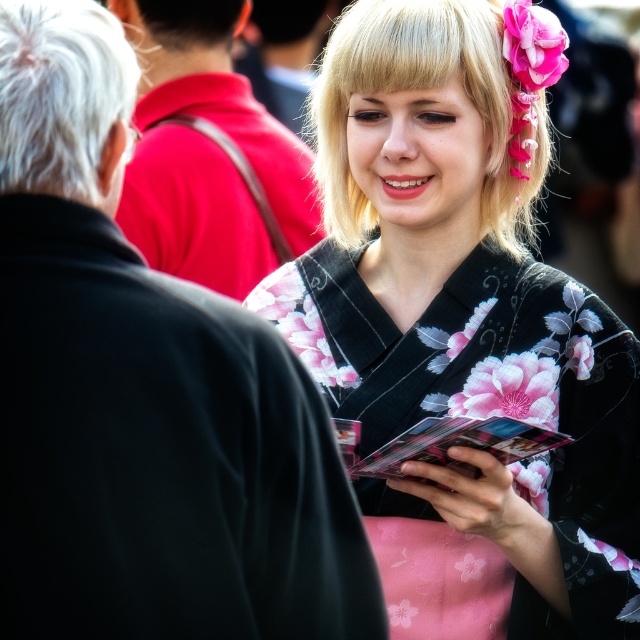
Question: Which point is farther to the camera?

Choices:
 (A) (380, 1)
 (B) (54, 92)

Answer: (A)

Question: Is black floral kimono at center above blonde hair at upper center?

Choices:
 (A) yes
 (B) no

Answer: (B)

Question: Where is blonde hair at upper center located in relation to matte black kimono at upper right in the image?

Choices:
 (A) below
 (B) above

Answer: (A)

Question: Is the position of black floral kimono at center more distant than that of matte black kimono at upper right?

Choices:
 (A) no
 (B) yes

Answer: (A)

Question: Which point appears closest to the camera in this image?

Choices:
 (A) (196, 92)
 (B) (506, 19)

Answer: (B)

Question: Among these objects, which one is nearest to the camera?

Choices:
 (A) white matte hair at left
 (B) black floral kimono at center

Answer: (A)